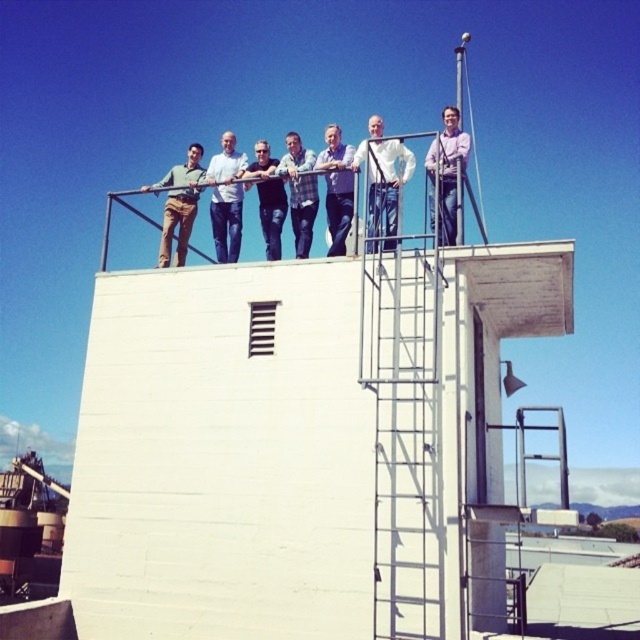
You are a photographer trying to capture a detailed shot of two specific points on the rooftop. The points are labeled as point 1 at coordinates point (234, 260) and point 2 at coordinates point (259, 164). Given that you want to focus on the point that is closer to you, which coordinate should you aim your camera at?

You should aim your camera at point (234, 260) because it is closer to the viewer than point (259, 164).